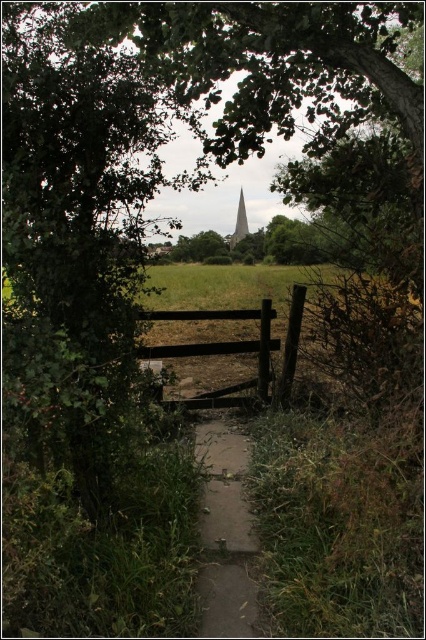
Question: Which point is closer to the camera?

Choices:
 (A) (181, 401)
 (B) (247, 221)
 (C) (215, 604)

Answer: (C)

Question: Is dull concrete path at center closer to the viewer compared to brown wooden fence at center?

Choices:
 (A) yes
 (B) no

Answer: (A)

Question: Which point appears closest to the camera in this image?

Choices:
 (A) (141, 346)
 (B) (210, 420)
 (C) (242, 220)

Answer: (A)

Question: Does dull concrete path at center appear on the right side of brown wooden fence at center?

Choices:
 (A) no
 (B) yes

Answer: (B)

Question: Does brown wooden fence at center have a lesser width compared to smooth stone tower at center?

Choices:
 (A) no
 (B) yes

Answer: (A)

Question: Which point is closer to the camera taking this photo?

Choices:
 (A) (227, 529)
 (B) (244, 204)
 (C) (158, 353)

Answer: (A)